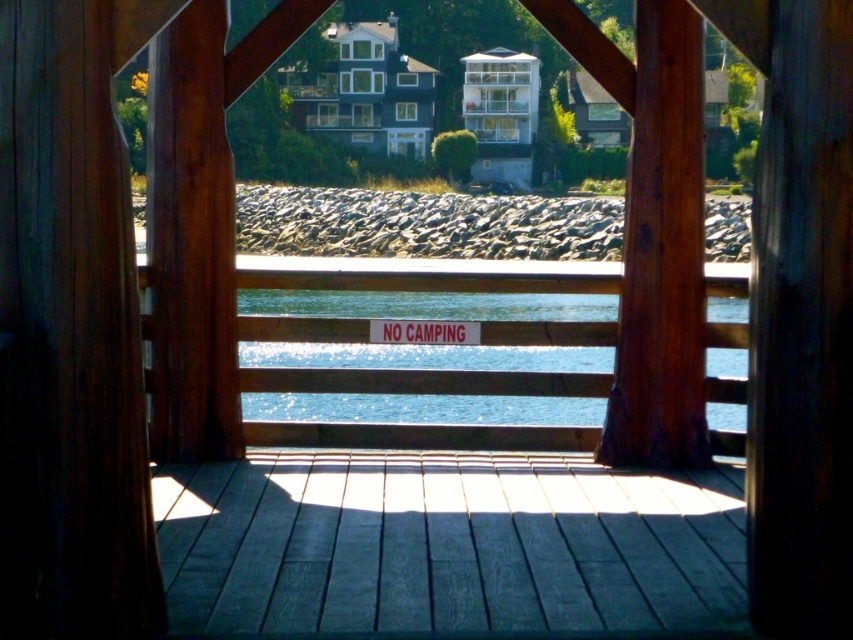
You are standing inside the wooden structure and notice the blue water at center and the white plastic sign at center. Which object is positioned higher from the ground?

The white plastic sign at center is higher than the blue water at center because the blue water at center is below the white plastic sign at center.

You are a hiker carrying a 10 foot long tent pole. You need to set up your tent on the smooth gray wood deck at center. Can you fit the tent pole entirely on the brown wood at center without bending it?

The smooth gray wood deck at center and brown wood at center are 10.36 feet apart from each other. Since the tent pole is 10 feet long, it can be placed diagonally across the space between them, allowing it to fit without bending.